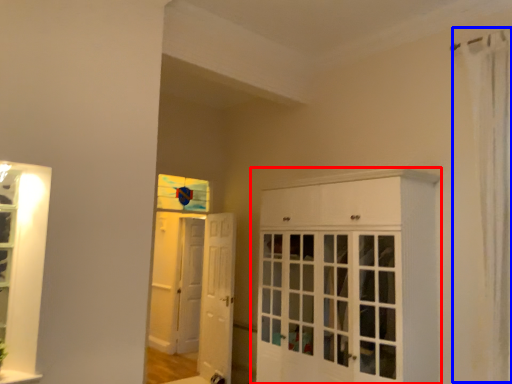
Question: Which object appears closest to the camera in this image, cabinetry (highlighted by a red box) or shower curtain (highlighted by a blue box)?

Choices:
 (A) cabinetry
 (B) shower curtain

Answer: (B)